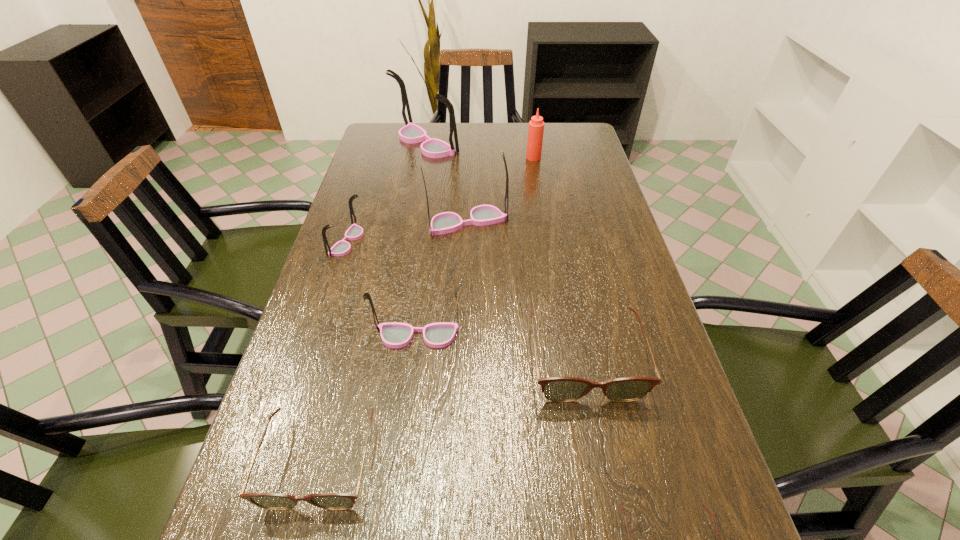
The height and width of the screenshot is (540, 960). Identify the location of object that is at the right edge. (559, 389).

What are the coordinates of `object present at the far left corner` in the screenshot? It's located at (411, 133).

In the image, there is a desktop. At what (x,y) coordinates should I click in order to perform the action: click on vacant space at the far edge. Please return your answer as a coordinate pair (x, y). Looking at the image, I should click on (526, 152).

Image resolution: width=960 pixels, height=540 pixels. In the image, there is a desktop. What are the coordinates of `free region at the left edge` in the screenshot? It's located at (331, 427).

This screenshot has height=540, width=960. Identify the location of blank space at the right edge of the desktop. (701, 519).

The image size is (960, 540). In the image, there is a desktop. Find the location of `vacant space at the far left corner`. vacant space at the far left corner is located at coordinates (373, 144).

Find the location of a particular element. Image resolution: width=960 pixels, height=540 pixels. free space between the Tabasco sauce and the smallest pink spectacles is located at coordinates (440, 200).

This screenshot has height=540, width=960. I want to click on empty location between the leftmost pink spectacles and the third tallest spectacles, so click(382, 289).

Where is `vacant space that's between the smallest pink spectacles and the farthest spectacles`? The width and height of the screenshot is (960, 540). vacant space that's between the smallest pink spectacles and the farthest spectacles is located at coordinates (386, 192).

Where is `empty space that is in between the third smallest pink spectacles and the Tabasco sauce`? This screenshot has height=540, width=960. empty space that is in between the third smallest pink spectacles and the Tabasco sauce is located at coordinates (500, 190).